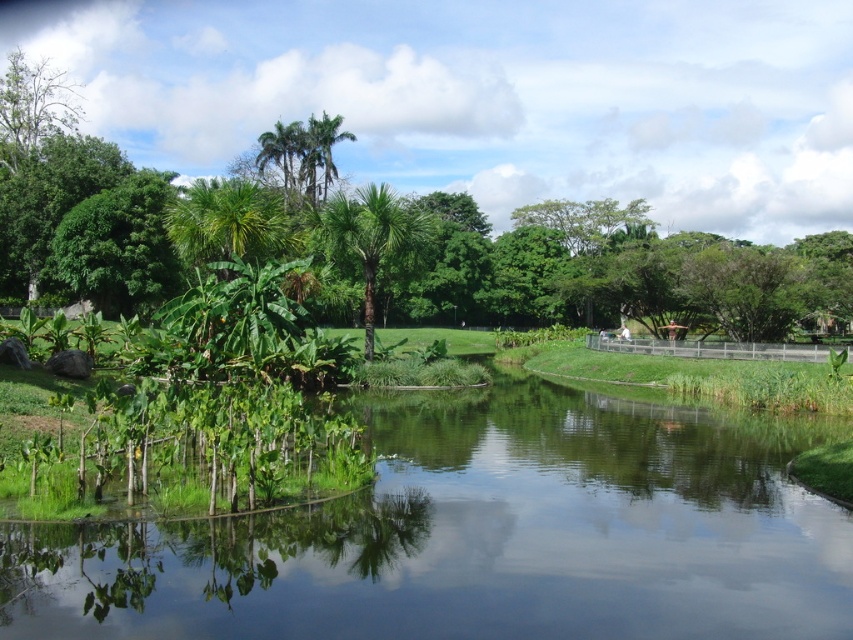
In the scene shown: You are standing at the edge of the pond and want to walk to the palm tree. Which direction should you walk to reach the green leafy palm tree at center without crossing the green leafy river at center?

The green leafy river at center is below the green leafy palm tree at center, so you should walk towards the upper direction to reach the green leafy palm tree at center without crossing the river.

You are standing in the serene natural scene and want to take a photo of both the green leafy river at center and the green leafy tree at upper left. Which object should you frame first in your camera viewfinder to ensure both are in the shot?

You should frame the green leafy tree at upper left first because the green leafy river at center is positioned on its right side, so by starting with the tree, you can adjust the viewfinder to include both objects.

You are standing at the center of the image and want to locate the green leafy river at center. What are the coordinates where you should look?

The green leafy river at center is located at coordinates point [480,536].